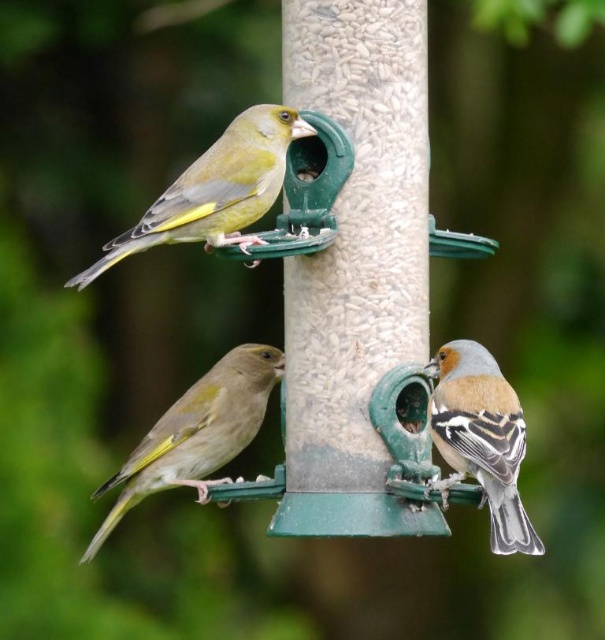
Does green plastic bird feeder at center appear on the left side of green matte bird at upper left?

No, green plastic bird feeder at center is not to the left of green matte bird at upper left.

Between green plastic bird feeder at center and green matte bird at upper left, which one is positioned higher?

Positioned higher is green matte bird at upper left.

The image size is (605, 640). Describe the element at coordinates (355, 275) in the screenshot. I see `green plastic bird feeder at center` at that location.

Find the location of `green plastic bird feeder at center`. green plastic bird feeder at center is located at coordinates (355, 275).

Is point (243, 236) less distant than point (462, 467)?

No.

Between green matte bird at upper left and brown speckled feathers at right, which one appears on the left side from the viewer's perspective?

From the viewer's perspective, green matte bird at upper left appears more on the left side.

Does point (159, 195) lie behind point (502, 483)?

Yes.

At what (x,y) coordinates should I click in order to perform the action: click on green matte bird at upper left. Please return your answer as a coordinate pair (x, y). Looking at the image, I should click on (215, 189).

Who is taller, green matte bird at upper left or green matte bird at center?

green matte bird at center is taller.

Does green matte bird at upper left appear on the right side of green matte bird at center?

Yes, green matte bird at upper left is to the right of green matte bird at center.

You are a GUI agent. You are given a task and a screenshot of the screen. Output one action in this format:
    pyautogui.click(x=<x>, y=<y>)
    Task: Click on the green matte bird at upper left
    The image size is (605, 640).
    Given the screenshot: What is the action you would take?
    (215, 189)